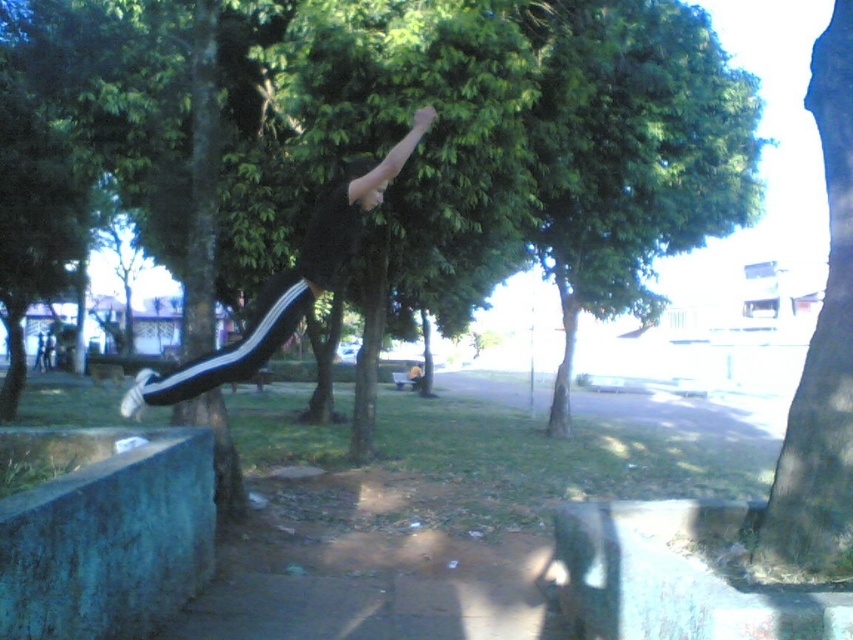
Which is in front, point (701, 51) or point (282, 314)?

Point (282, 314) is more forward.

Between green leafy tree at center and black matte track pants at center, which one appears on the left side from the viewer's perspective?

black matte track pants at center is more to the left.

Is point (572, 192) farther from viewer compared to point (345, 241)?

Yes, it is behind point (345, 241).

Where is `green leafy tree at center`? green leafy tree at center is located at coordinates (634, 154).

The image size is (853, 640). What do you see at coordinates (634, 154) in the screenshot? I see `green leafy tree at center` at bounding box center [634, 154].

Does green leafy tree at center appear on the right side of green leafy tree at right?

No, green leafy tree at center is not to the right of green leafy tree at right.

Identify the location of green leafy tree at center. This screenshot has width=853, height=640. (634, 154).

Is the position of green leafy tree at right more distant than that of black matte track pants at center?

No, green leafy tree at right is in front of black matte track pants at center.

Does green leafy tree at right appear on the right side of black matte track pants at center?

Correct, you'll find green leafy tree at right to the right of black matte track pants at center.

The width and height of the screenshot is (853, 640). In order to click on green leafy tree at right in this screenshot , I will do `click(822, 344)`.

Find the location of a particular element. This screenshot has height=640, width=853. green leafy tree at right is located at coordinates [x=822, y=344].